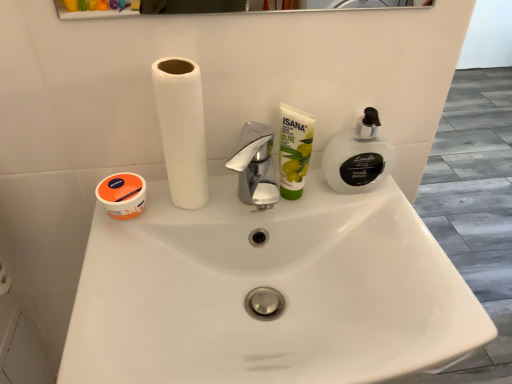
The image size is (512, 384). I want to click on empty space that is to the right of orange matte cream at left, so point(218,211).